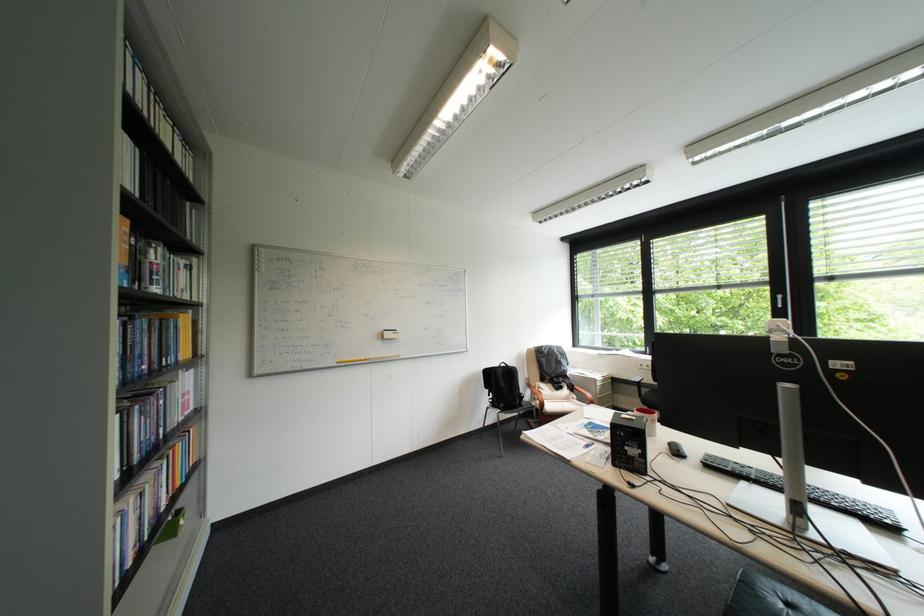
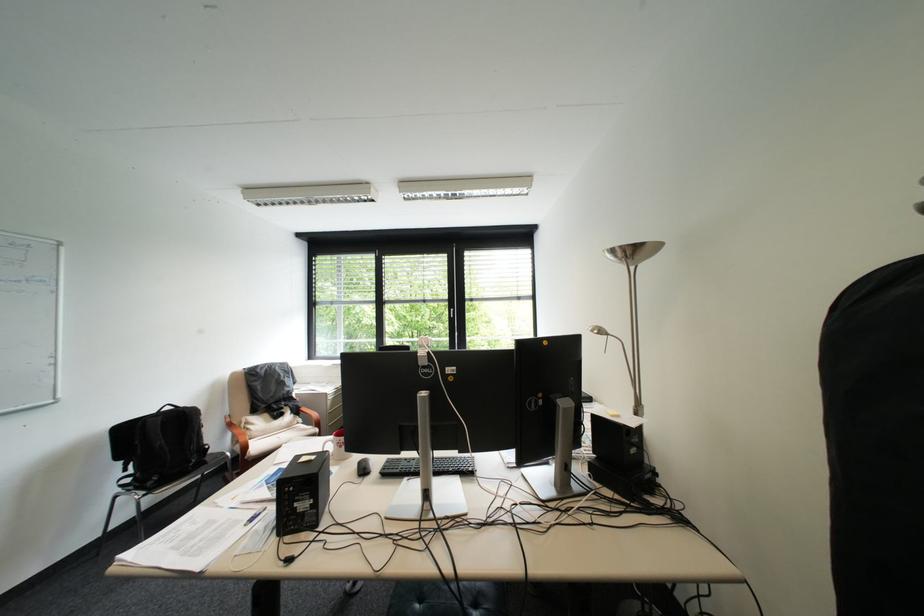
Find the pixel in the second image that matches pixel 847 505 in the first image.

(463, 469)